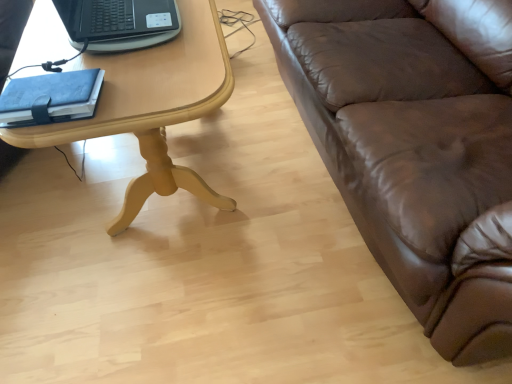
Question: Is brown leather couch at right taller or shorter than black plastic laptop at upper left?

Choices:
 (A) short
 (B) tall

Answer: (B)

Question: Is brown leather couch at right in front of or behind black plastic laptop at upper left in the image?

Choices:
 (A) front
 (B) behind

Answer: (A)

Question: Estimate the real-world distances between objects in this image. Which object is farther from the brown leather couch at right?

Choices:
 (A) blue leather notebook at left
 (B) black plastic laptop at upper left
 (C) light wood/yellowishmaterial/texture table at left

Answer: (A)

Question: Considering the real-world distances, which object is farthest from the blue leather notebook at left?

Choices:
 (A) brown leather couch at right
 (B) black plastic laptop at upper left
 (C) light wood/yellowishmaterial/texture table at left

Answer: (A)